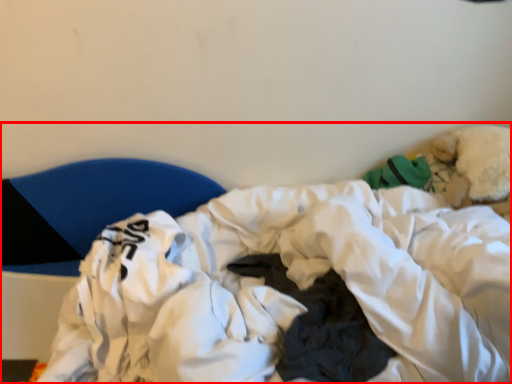
Question: From the image's perspective, considering the relative positions of hospital bed (annotated by the red box) and furniture in the image provided, where is hospital bed (annotated by the red box) located with respect to the staircase?

Choices:
 (A) above
 (B) below

Answer: (B)